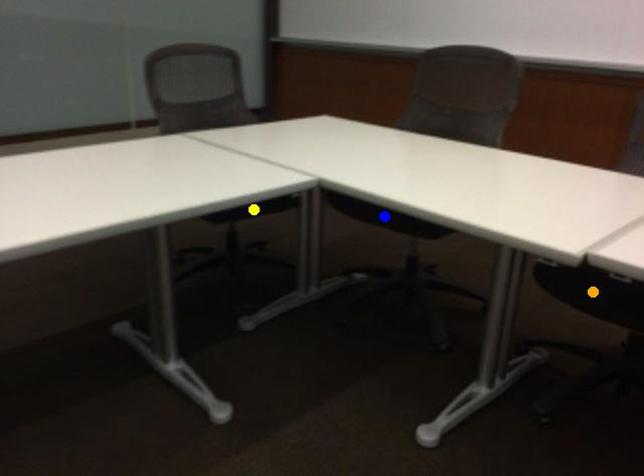
Order these from nearest to farthest:
A) blue point
B) orange point
C) yellow point

yellow point, blue point, orange point